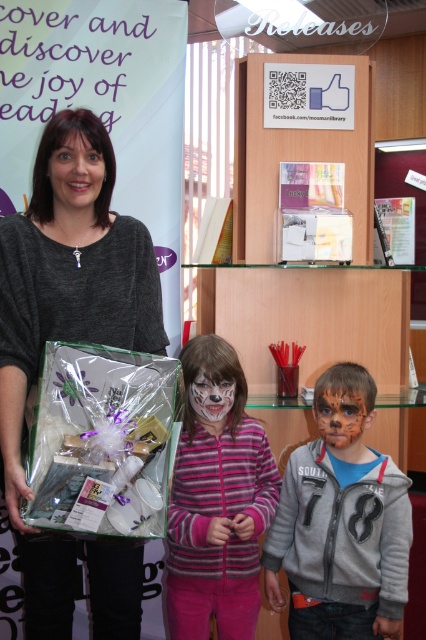
Question: Is matte black sweater at upper left smaller than matte gray hoodie at center?

Choices:
 (A) yes
 (B) no

Answer: (B)

Question: Which point is farther to the camera?

Choices:
 (A) matte gray hoodie at center
 (B) matte black sweater at upper left
 (C) orange matte face paint at center
 (D) matte black face at upper left

Answer: (C)

Question: Can you confirm if matte black sweater at upper left is thinner than matte black face at upper left?

Choices:
 (A) no
 (B) yes

Answer: (A)

Question: Which point is farther from the camera taking this photo?

Choices:
 (A) 193,394
 (B) 192,340
 (C) 63,148

Answer: (B)

Question: Can you confirm if matte black face at upper left is positioned above orange matte face paint at center?

Choices:
 (A) yes
 (B) no

Answer: (A)

Question: Which point is closer to the camera taking this photo?

Choices:
 (A) (193, 384)
 (B) (331, 445)
 (C) (298, 529)
 (D) (81, 145)

Answer: (D)